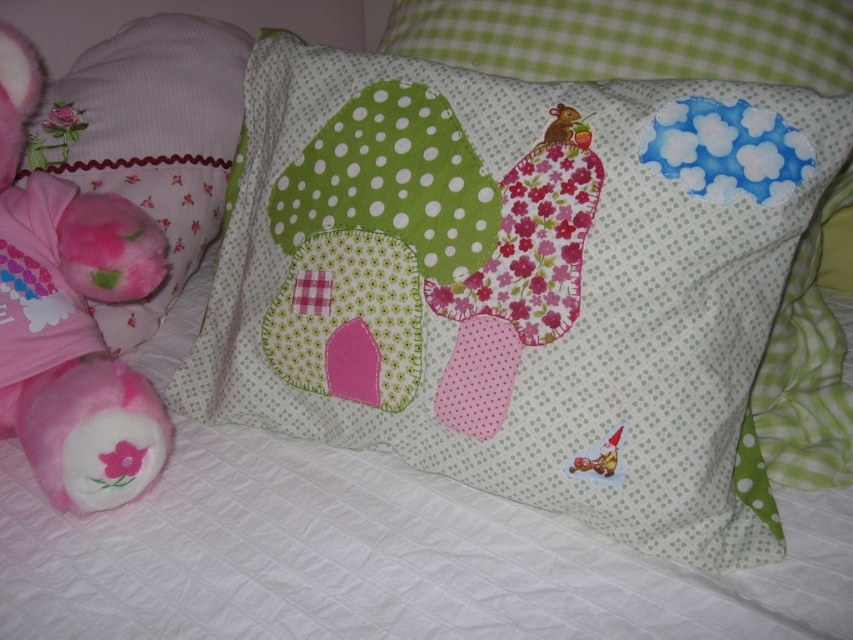
Is fluffy pink plush at left above pink fabric pillow at left?

Incorrect, fluffy pink plush at left is not positioned above pink fabric pillow at left.

Is point (50, 490) in front of point (142, 115)?

Yes, point (50, 490) is closer to viewer.

Measure the distance between point (158,237) and camera.

Point (158,237) is 91.93 centimeters away from camera.

Locate an element on the screen. Image resolution: width=853 pixels, height=640 pixels. fluffy pink plush at left is located at coordinates [x=70, y=317].

Looking at this image, which of these two, fluffy pink plush at left or green polka dot fabric at upper center, stands shorter?

green polka dot fabric at upper center is shorter.

You are a GUI agent. You are given a task and a screenshot of the screen. Output one action in this format:
    pyautogui.click(x=<x>, y=<y>)
    Task: Click on the fluffy pink plush at left
    The image size is (853, 640).
    Given the screenshot: What is the action you would take?
    pyautogui.click(x=70, y=317)

Can you confirm if pink fabric pillow at left is positioned to the left of green polka dot fabric at upper center?

Correct, you'll find pink fabric pillow at left to the left of green polka dot fabric at upper center.

Is point (165, 99) farther from camera compared to point (550, 80)?

Yes, it is.

Find the location of `pink fabric pillow at left`. pink fabric pillow at left is located at coordinates (149, 140).

Where is `pink fabric pillow at left`? Image resolution: width=853 pixels, height=640 pixels. pink fabric pillow at left is located at coordinates (149, 140).